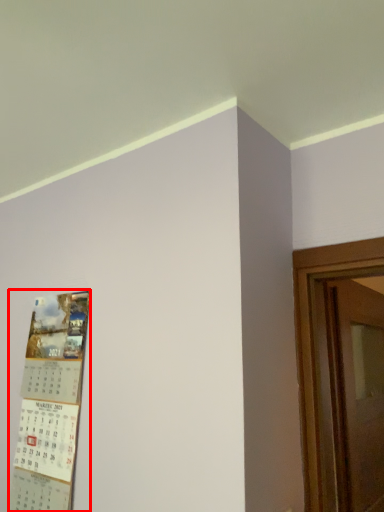
Question: From the image, what is the correct spatial relationship of poster (annotated by the red box) in relation to door?

Choices:
 (A) left
 (B) right

Answer: (A)